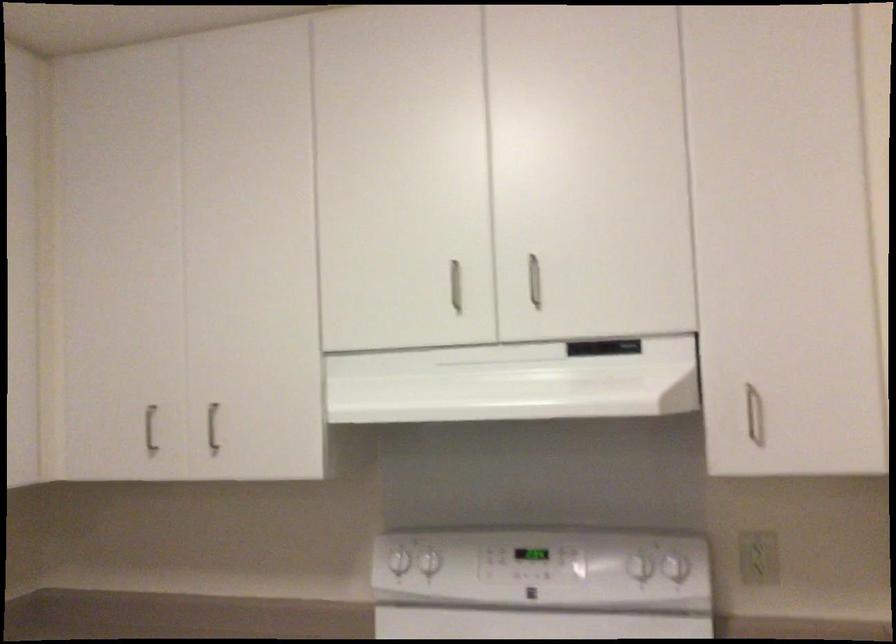
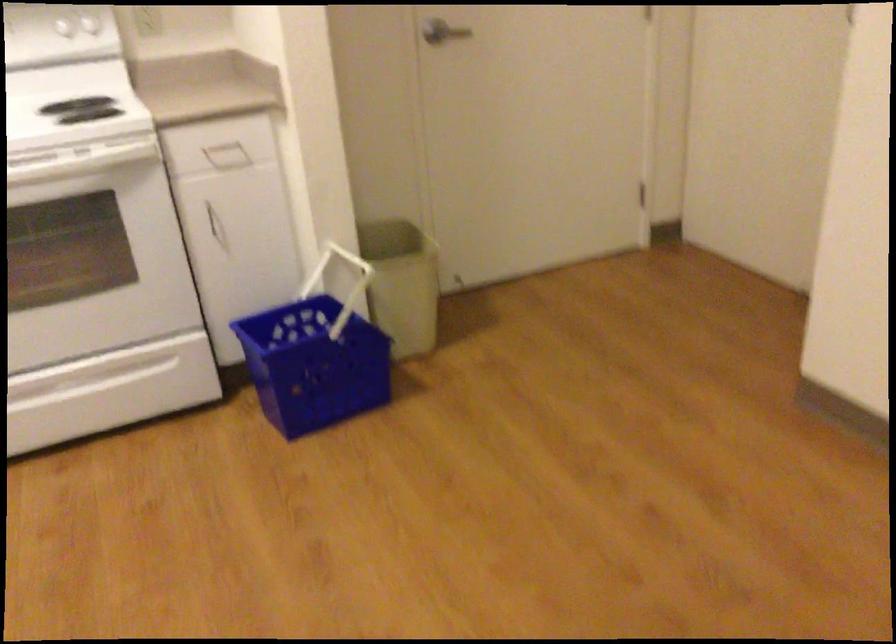
The point at (662, 563) is marked in the first image. Where is the corresponding point in the second image?

(80, 26)